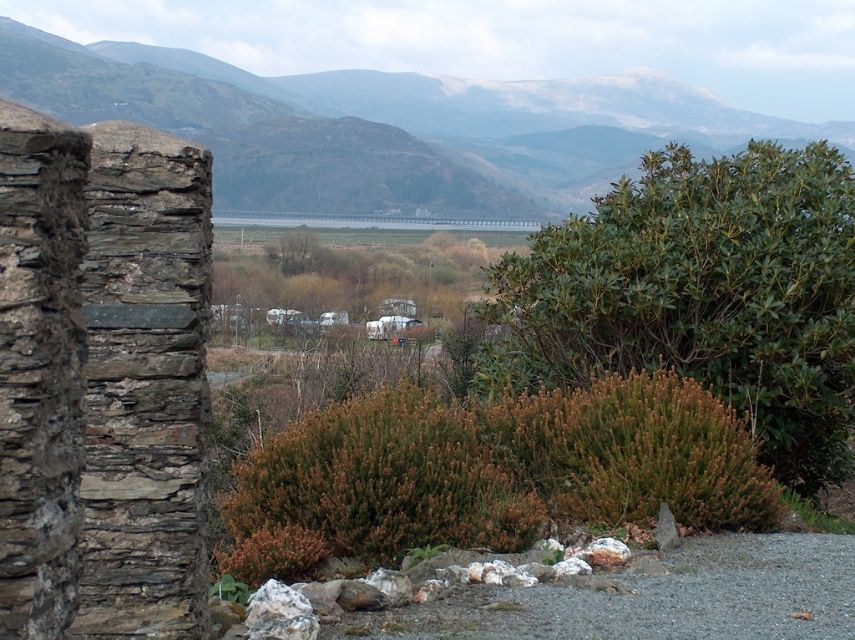
Between point (528, 340) and point (393, 538), which one is positioned behind?

The point (528, 340) is behind.

Which is more to the right, green leafy bush at upper right or brown fuzzy bush at center?

Positioned to the right is green leafy bush at upper right.

This screenshot has width=855, height=640. What do you see at coordinates (700, 296) in the screenshot?
I see `green leafy bush at upper right` at bounding box center [700, 296].

Find the location of a particular element. This screenshot has height=640, width=855. green leafy bush at upper right is located at coordinates (700, 296).

Is green leafy bush at upper right closer to the viewer compared to green grassy mountain at upper center?

Yes.

Does green leafy bush at upper right have a larger size compared to green grassy mountain at upper center?

Indeed, green leafy bush at upper right has a larger size compared to green grassy mountain at upper center.

The image size is (855, 640). I want to click on green leafy bush at upper right, so click(x=700, y=296).

Does point (758, 138) come farther from viewer compared to point (264, 483)?

Yes.

Is point (612, 115) positioned in front of point (490, 426)?

No, (612, 115) is behind (490, 426).

Does point (517, 104) come closer to viewer compared to point (273, 467)?

No, (517, 104) is behind (273, 467).

Where is `green grassy mountain at upper center`? green grassy mountain at upper center is located at coordinates (x=386, y=128).